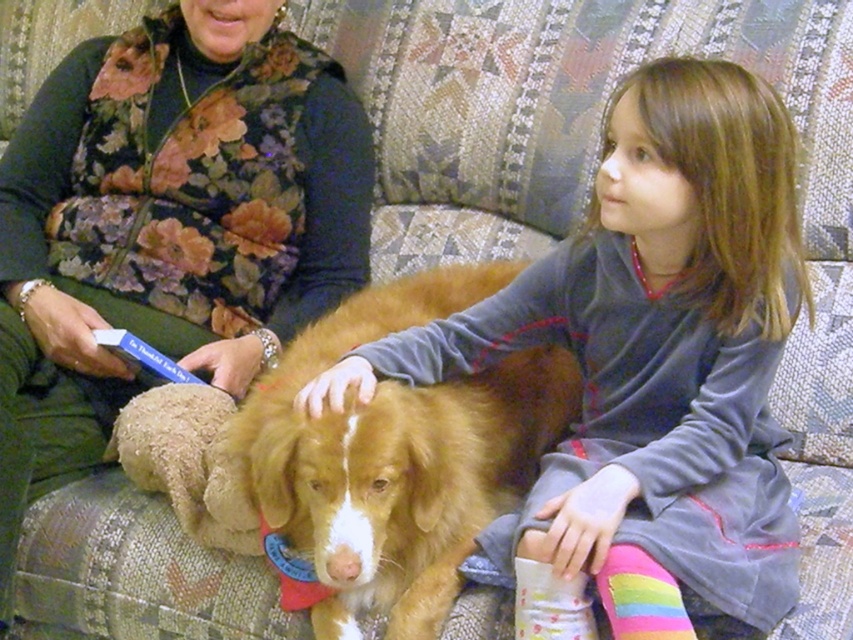
Between velvety gray dress at center and floral-patterned vest at upper left, which one appears on the right side from the viewer's perspective?

From the viewer's perspective, velvety gray dress at center appears more on the right side.

This screenshot has width=853, height=640. Find the location of `velvety gray dress at center`. velvety gray dress at center is located at coordinates (651, 348).

Does point (746, 355) come closer to viewer compared to point (73, 212)?

Yes, point (746, 355) is closer to viewer.

The width and height of the screenshot is (853, 640). I want to click on velvety gray dress at center, so click(651, 348).

Is velvety gray dress at center wider than fuzzy brown dog at center?

Correct, the width of velvety gray dress at center exceeds that of fuzzy brown dog at center.

Is the position of velvety gray dress at center less distant than that of fuzzy brown dog at center?

Yes, it is.

Which is behind, point (569, 444) or point (381, 518)?

The point (569, 444) is more distant.

Locate an element on the screen. Image resolution: width=853 pixels, height=640 pixels. velvety gray dress at center is located at coordinates (651, 348).

In the scene shown: Is velvety gray dress at center to the right of white cotton sock at lower center from the viewer's perspective?

Correct, you'll find velvety gray dress at center to the right of white cotton sock at lower center.

Is velvety gray dress at center above white cotton sock at lower center?

Correct, velvety gray dress at center is located above white cotton sock at lower center.

Where is `velvety gray dress at center`? velvety gray dress at center is located at coordinates (651, 348).

The width and height of the screenshot is (853, 640). In order to click on velvety gray dress at center in this screenshot , I will do `click(651, 348)`.